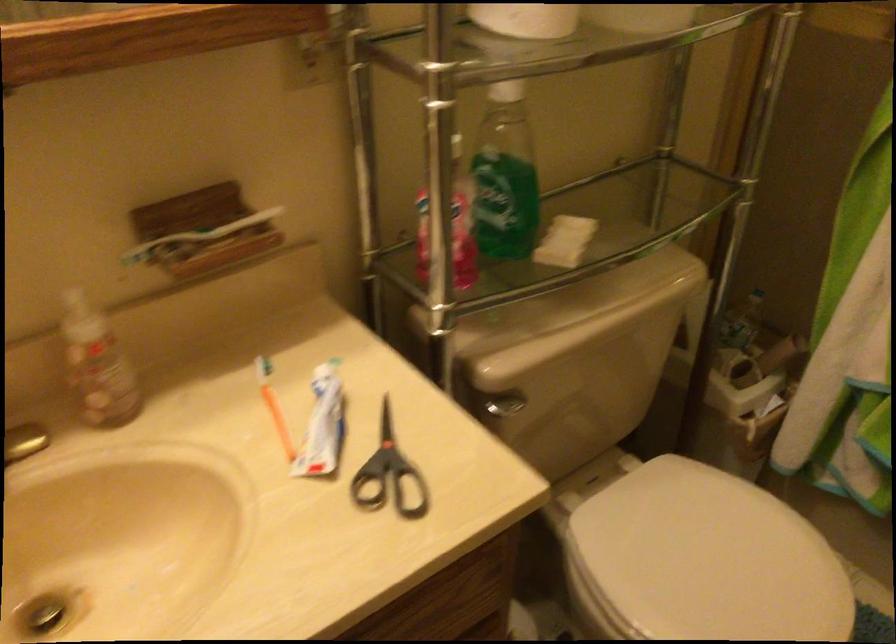
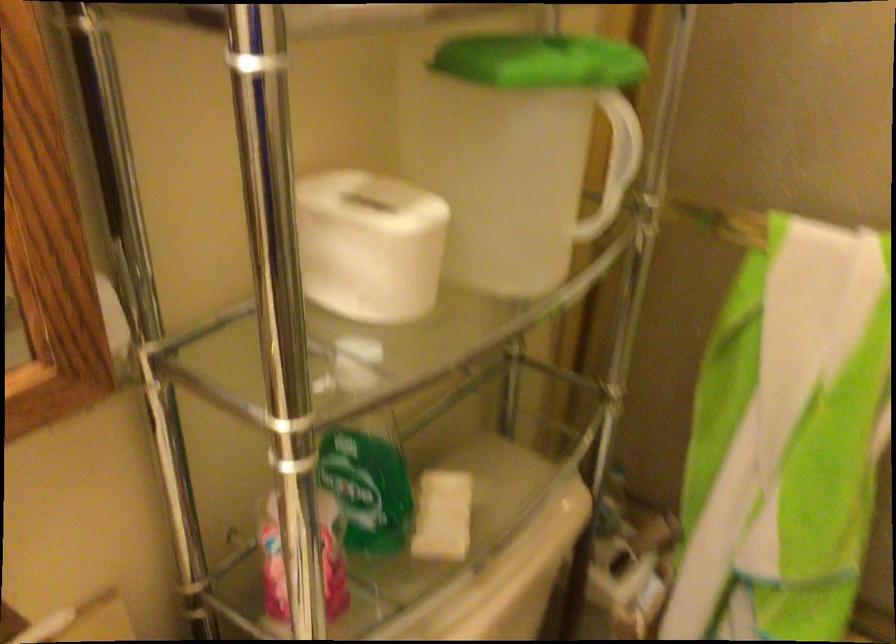
Question: Based on the continuous images, in which direction is the camera rotating? Reply with the corresponding letter.

Choices:
 (A) Left
 (B) Right
 (C) Up
 (D) Down

Answer: (B)